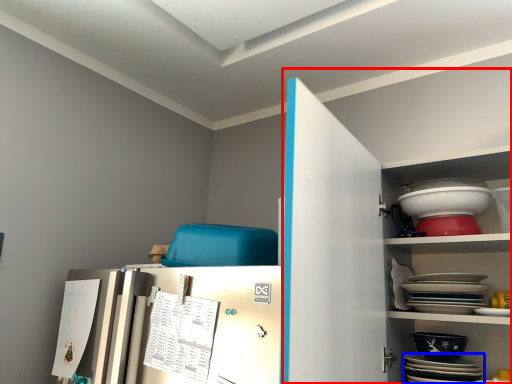
Question: Which point is further to the camera, dresser (highlighted by a red box) or platter (highlighted by a blue box)?

Choices:
 (A) dresser
 (B) platter

Answer: (B)